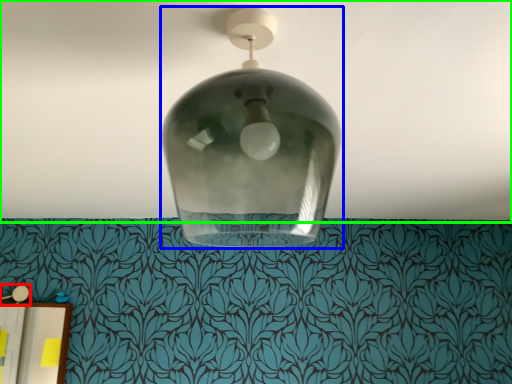
Question: Based on their relative distances, which object is nearer to lamp (highlighted by a red box)? Choose from lamp (highlighted by a blue box) and atmosphere (highlighted by a green box).

Choices:
 (A) lamp
 (B) atmosphere

Answer: (B)